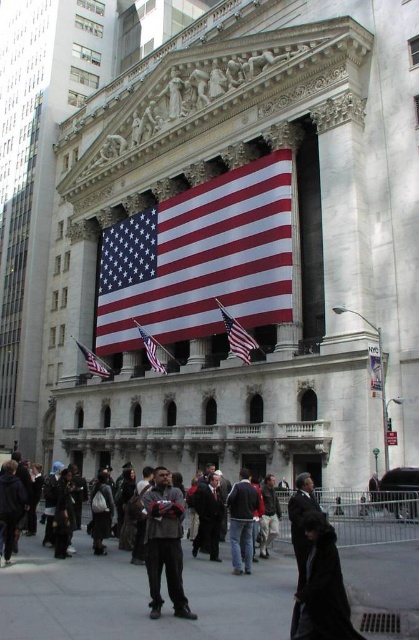
Find the location of a particular element. This screenshot has width=419, height=640. dark brown leather coat at lower right is located at coordinates (321, 588).

Based on the photo, is dark brown leather coat at lower right shorter than red fabric flag at center?

Incorrect, dark brown leather coat at lower right's height does not fall short of red fabric flag at center's.

Between point (313, 570) and point (229, 321), which one is positioned behind?

Point (229, 321)

The height and width of the screenshot is (640, 419). Find the location of `dark brown leather coat at lower right`. dark brown leather coat at lower right is located at coordinates (x=321, y=588).

From the picture: Who is higher up, dark suit at center or matte fabric flag at lower left?

matte fabric flag at lower left is higher up.

Is point (295, 477) positioned in front of point (80, 342)?

Yes, it is.

This screenshot has width=419, height=640. I want to click on dark suit at center, so click(302, 522).

This screenshot has width=419, height=640. What do you see at coordinates (201, 259) in the screenshot?
I see `red-white striped flag at center` at bounding box center [201, 259].

Who is taller, red-white striped flag at center or matte fabric flag at lower left?

With more height is red-white striped flag at center.

Image resolution: width=419 pixels, height=640 pixels. Describe the element at coordinates (201, 259) in the screenshot. I see `red-white striped flag at center` at that location.

Image resolution: width=419 pixels, height=640 pixels. I want to click on red-white striped flag at center, so click(x=201, y=259).